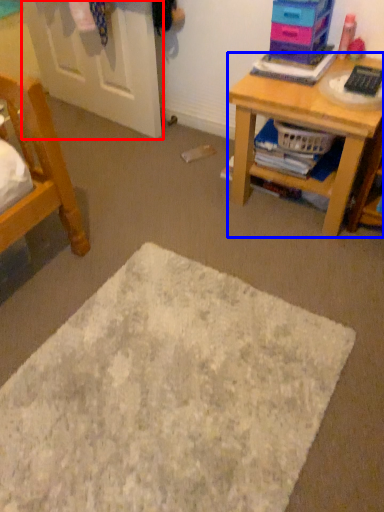
Question: Which object appears farthest to the camera in this image, door (highlighted by a red box) or desk (highlighted by a blue box)?

Choices:
 (A) door
 (B) desk

Answer: (A)